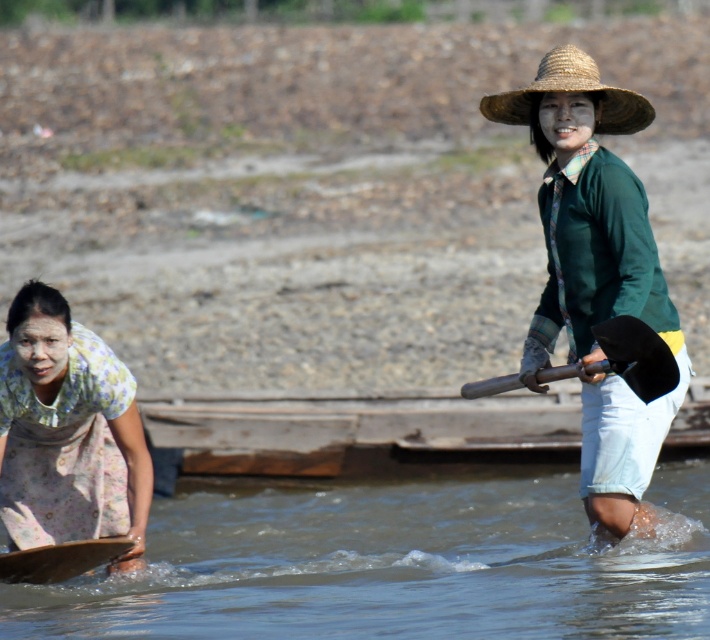
The image size is (710, 640). What do you see at coordinates (595, 275) in the screenshot?
I see `green matte shirt at center` at bounding box center [595, 275].

Locate an element on the screen. The height and width of the screenshot is (640, 710). green matte shirt at center is located at coordinates (595, 275).

I want to click on green matte shirt at center, so (595, 275).

Does strawmaterial/texturehat at upper center have a greater height compared to black rubber paddle at right?

Yes.

Is strawmaterial/texturehat at upper center shorter than black rubber paddle at right?

No, strawmaterial/texturehat at upper center is not shorter than black rubber paddle at right.

Which is behind, point (501, 120) or point (645, 362)?

Point (501, 120)

You are a GUI agent. You are given a task and a screenshot of the screen. Output one action in this format:
    pyautogui.click(x=<x>, y=<y>)
    Task: Click on the strawmaterial/texturehat at upper center
    
    Given the screenshot: What is the action you would take?
    click(x=569, y=90)

Locate an element on the screen. floral fabric skirt at lower left is located at coordinates (67, 433).

Which is in front, point (67, 353) or point (618, 364)?

Point (618, 364)

The image size is (710, 640). Identify the location of floral fabric skirt at lower left. (67, 433).

The width and height of the screenshot is (710, 640). Find the location of `floral fabric skirt at lower left`. floral fabric skirt at lower left is located at coordinates (67, 433).